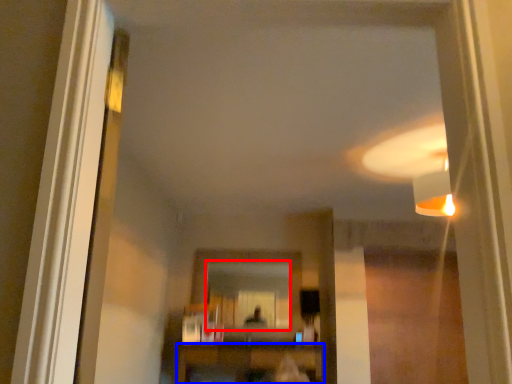
Question: Which of the following is the farthest to the observer, mirror (highlighted by a red box) or furniture (highlighted by a blue box)?

Choices:
 (A) mirror
 (B) furniture

Answer: (A)